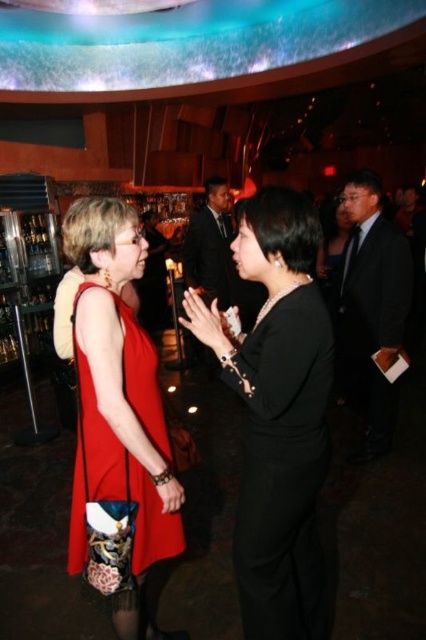
Is point (86, 388) farther from viewer compared to point (348, 218)?

No.

The height and width of the screenshot is (640, 426). Describe the element at coordinates (114, 484) in the screenshot. I see `matte red dress at center` at that location.

Locate an element on the screen. The height and width of the screenshot is (640, 426). matte red dress at center is located at coordinates (114, 484).

Can you confirm if black satin dress at center is thinner than dark suit at right?

In fact, black satin dress at center might be wider than dark suit at right.

Between black satin dress at center and dark suit at right, which one is positioned higher?

dark suit at right is higher up.

Image resolution: width=426 pixels, height=640 pixels. I want to click on black satin dress at center, so click(x=278, y=416).

Can you confirm if black satin dress at center is positioned to the right of matte red dress at center?

Yes, black satin dress at center is to the right of matte red dress at center.

Identify the location of black satin dress at center. This screenshot has width=426, height=640. (278, 416).